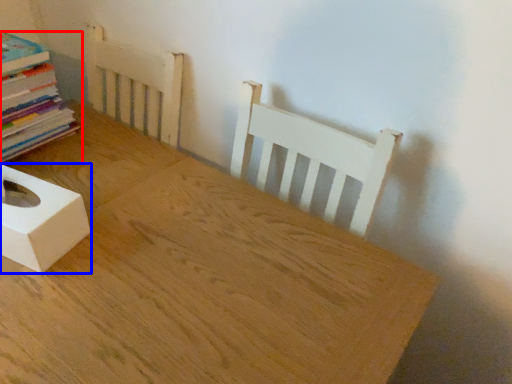
Question: Among these objects, which one is farthest to the camera, book (highlighted by a red box) or box (highlighted by a blue box)?

Choices:
 (A) book
 (B) box

Answer: (A)